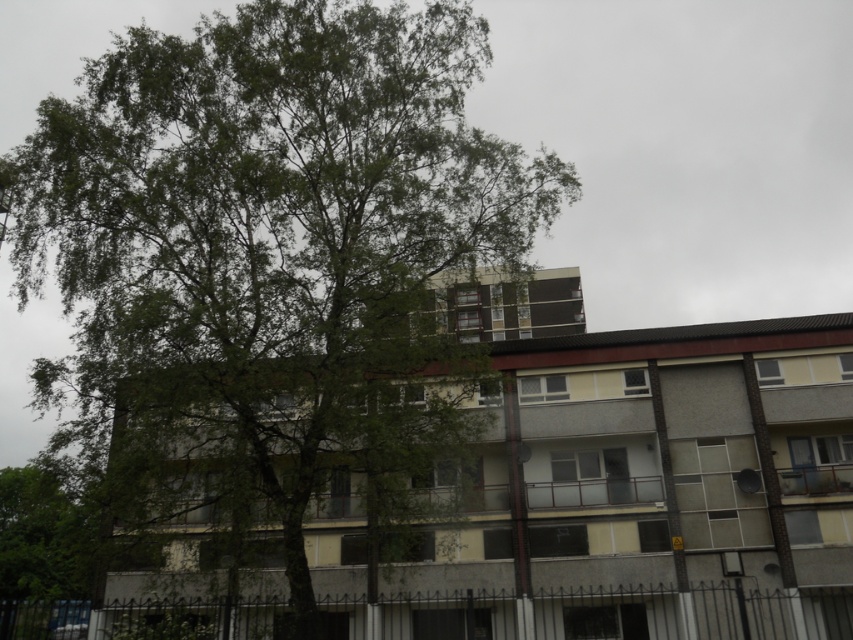
Can you confirm if green leafy tree at center is shorter than green leafy tree at lower left?

Incorrect, green leafy tree at center's height does not fall short of green leafy tree at lower left's.

Is green leafy tree at center wider than green leafy tree at lower left?

Correct, the width of green leafy tree at center exceeds that of green leafy tree at lower left.

Measure the distance between green leafy tree at center and camera.

They are 28.84 feet apart.

This screenshot has width=853, height=640. Identify the location of green leafy tree at center. (271, 253).